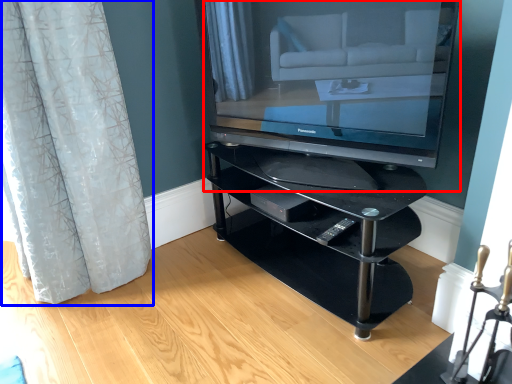
Question: Among these objects, which one is farthest to the camera, television (highlighted by a red box) or curtain (highlighted by a blue box)?

Choices:
 (A) television
 (B) curtain

Answer: (B)